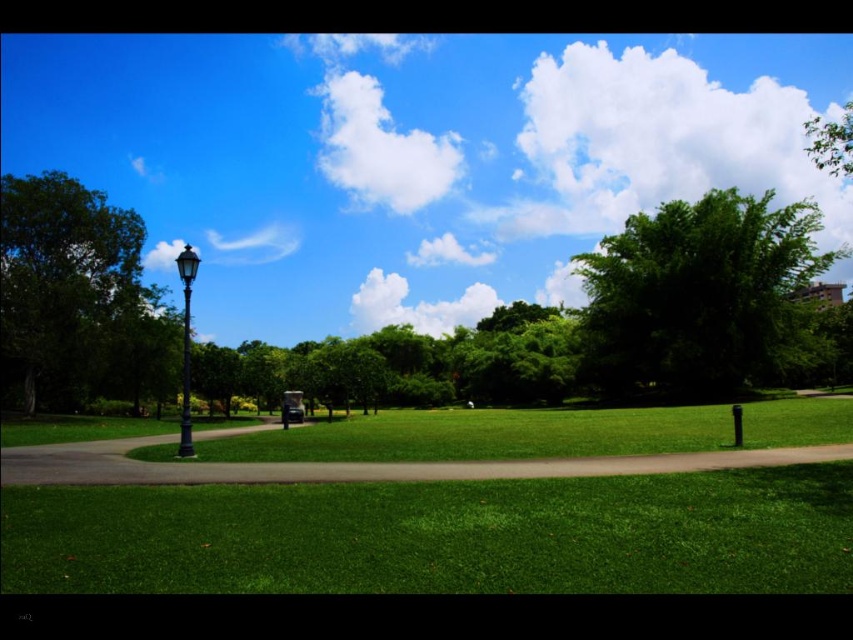
In the scene shown: Is green leafy tree at center below polished blue glass lamp post at left?

Indeed, green leafy tree at center is positioned under polished blue glass lamp post at left.

Does green leafy tree at center have a smaller size compared to polished blue glass lamp post at left?

No.

Find the location of a particular element. The width and height of the screenshot is (853, 640). green leafy tree at center is located at coordinates (405, 364).

Which of these two, green leafy tree at right or green leafy tree at left, stands taller?

green leafy tree at right

Locate an element on the screen. The height and width of the screenshot is (640, 853). green leafy tree at right is located at coordinates (697, 292).

Locate an element on the screen. The height and width of the screenshot is (640, 853). green leafy tree at right is located at coordinates (697, 292).

Looking at this image, can you confirm if green leafy tree at left is positioned to the right of green leafy tree at center?

No, green leafy tree at left is not to the right of green leafy tree at center.

From the picture: Who is taller, green leafy tree at left or green leafy tree at center?

green leafy tree at center

At what (x,y) coordinates should I click in order to perform the action: click on green leafy tree at left. Please return your answer as a coordinate pair (x, y). Image resolution: width=853 pixels, height=640 pixels. Looking at the image, I should click on (77, 300).